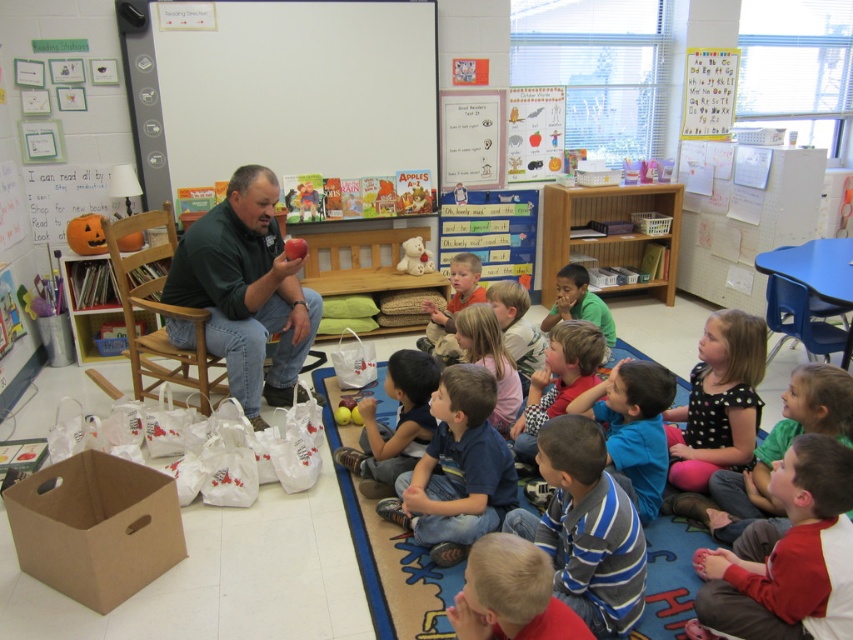
You are a child sitting on the blue rug in the classroom. The teacher is holding an object. Which object is closer to your left side, the light brown plush dog at center or the red matte apple at center?

The red matte apple at center is closer to your left side because the light brown plush dog at center is to the right of it.

You are standing in the classroom and want to place a new poster on the wall. The wall has a coordinate system where the bottom left corner is the origin. The white matte board at upper center is located at point (277,88). If you want to hang a poster 0.1 units to the right and 0.05 units down from the white matte board at upper center, what are the coordinates of the new poster?

The new poster should be placed at coordinates 0.239, 0.276 because adding 0.1 to the x coordinate of the white matte board at upper center and subtracting 0.05 from the y coordinate gives 0.139 0.326 plus 0.1 minus 0.05 equals 0.239, 0.276.

You are a student sitting on the blue rug in the classroom. You see the light brown plush dog at center and the red matte apple at center. Which object is closer to the floor?

The light brown plush dog at center is closer to the floor because it is positioned below the red matte apple at center.